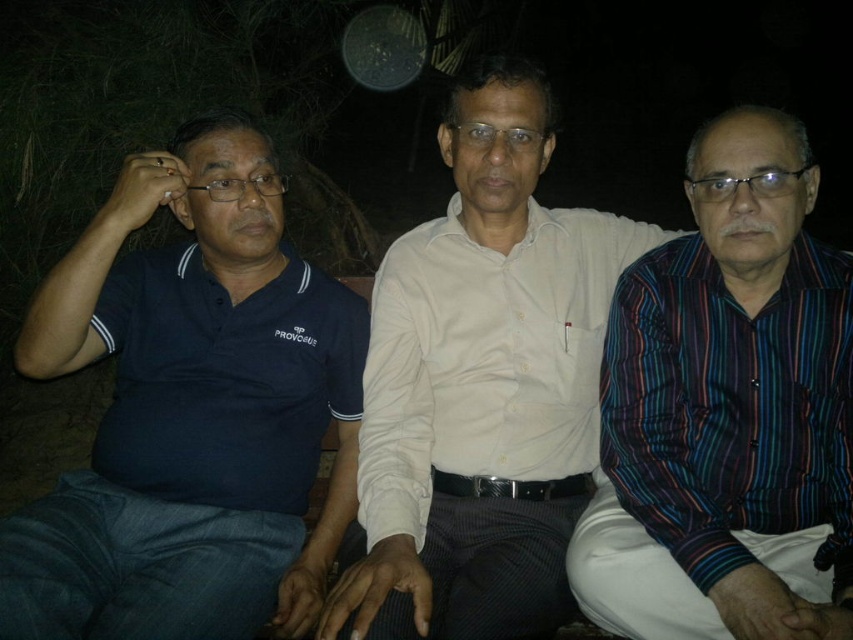
Question: Is white cotton shirt at center below dark blue cotton polo shirt at left?

Choices:
 (A) no
 (B) yes

Answer: (A)

Question: Considering the real-world distances, which object is farthest from the dark blue cotton polo shirt at left?

Choices:
 (A) white cotton shirt at center
 (B) dark blue polo shirt at left
 (C) striped cotton shirt at right

Answer: (C)

Question: Does dark blue polo shirt at left appear over dark blue cotton polo shirt at left?

Choices:
 (A) no
 (B) yes

Answer: (B)

Question: Which point is closer to the camera?

Choices:
 (A) dark blue cotton polo shirt at left
 (B) striped cotton shirt at right
 (C) dark blue polo shirt at left

Answer: (C)

Question: Which object appears farthest from the camera in this image?

Choices:
 (A) dark blue polo shirt at left
 (B) white cotton shirt at center
 (C) striped cotton shirt at right
 (D) dark blue cotton polo shirt at left

Answer: (D)

Question: Is dark blue polo shirt at left closer to the viewer compared to striped cotton shirt at right?

Choices:
 (A) no
 (B) yes

Answer: (B)